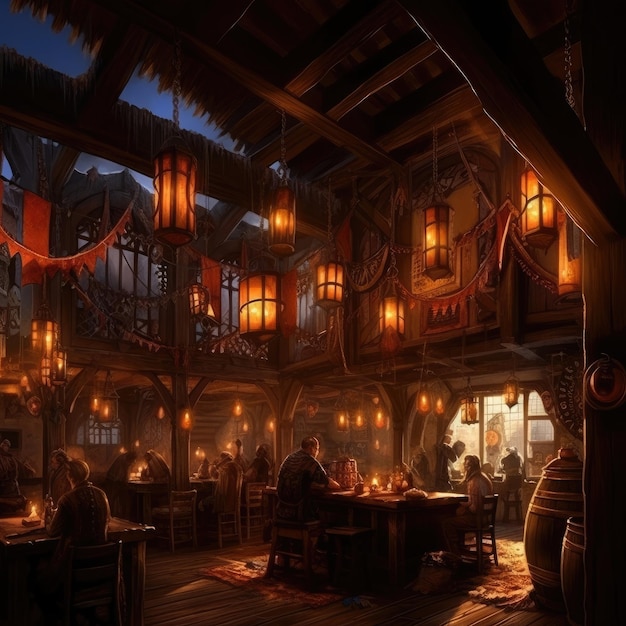
This screenshot has height=626, width=626. In order to click on floor in this screenshot , I will do `click(232, 606)`.